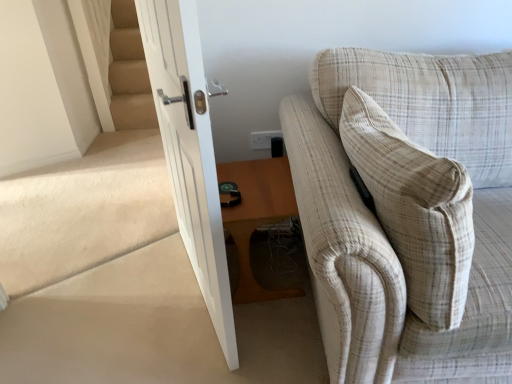
Find the location of `free space to the back side of beige carpeted stairs at left`. free space to the back side of beige carpeted stairs at left is located at coordinates (113, 238).